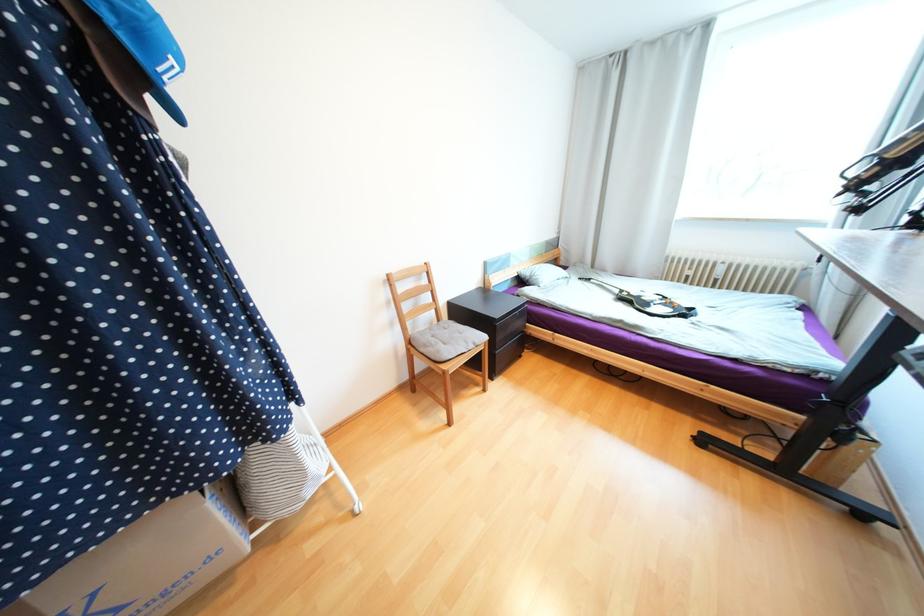
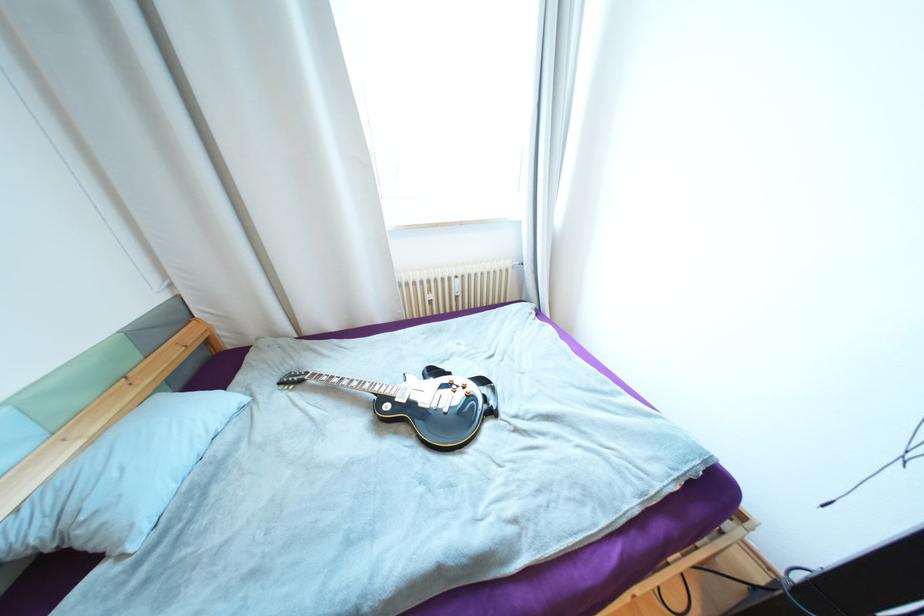
Where in the second image is the point corresponding to pixel 722 281 from the first image?

(463, 297)